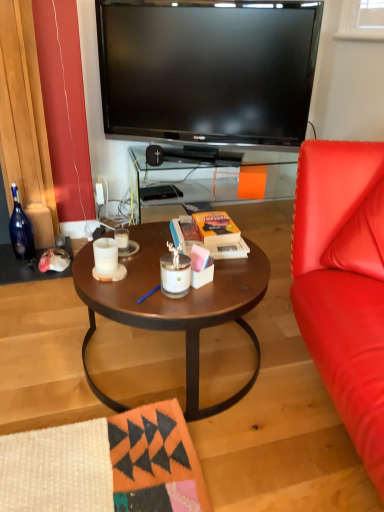
Where is `vacant space situated above orange matte book at center (from a real-world perspective)`? This screenshot has width=384, height=512. vacant space situated above orange matte book at center (from a real-world perspective) is located at coordinates (212, 220).